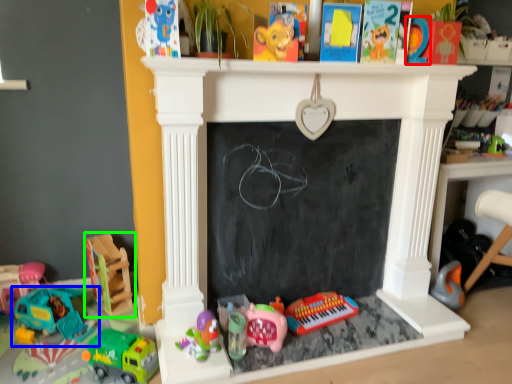
Question: Considering the real-world distances, which object is farthest from toy (highlighted by a red box)? toy (highlighted by a blue box) or toy (highlighted by a green box)?

Choices:
 (A) toy
 (B) toy

Answer: (A)